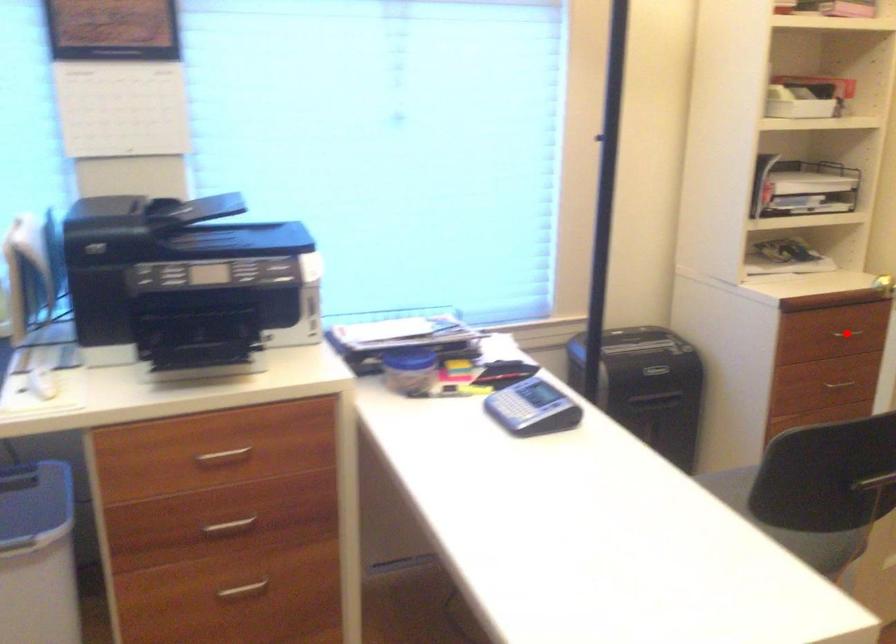
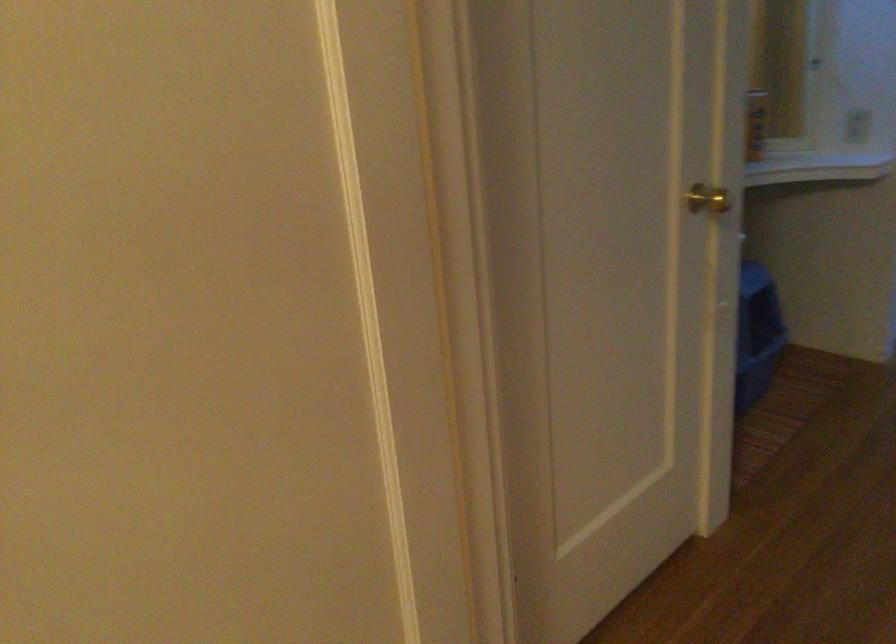
Question: I am providing you with two images of the same scene from different viewpoints. A red point is marked on the first image. At the location where the point appears in image 1, is it still visible in image 2?

Choices:
 (A) Yes
 (B) No

Answer: (B)